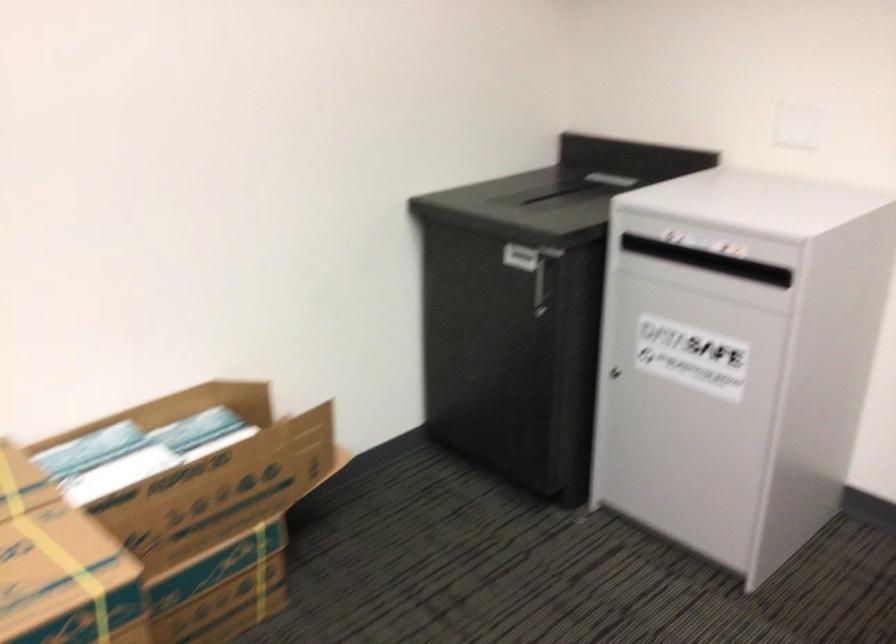
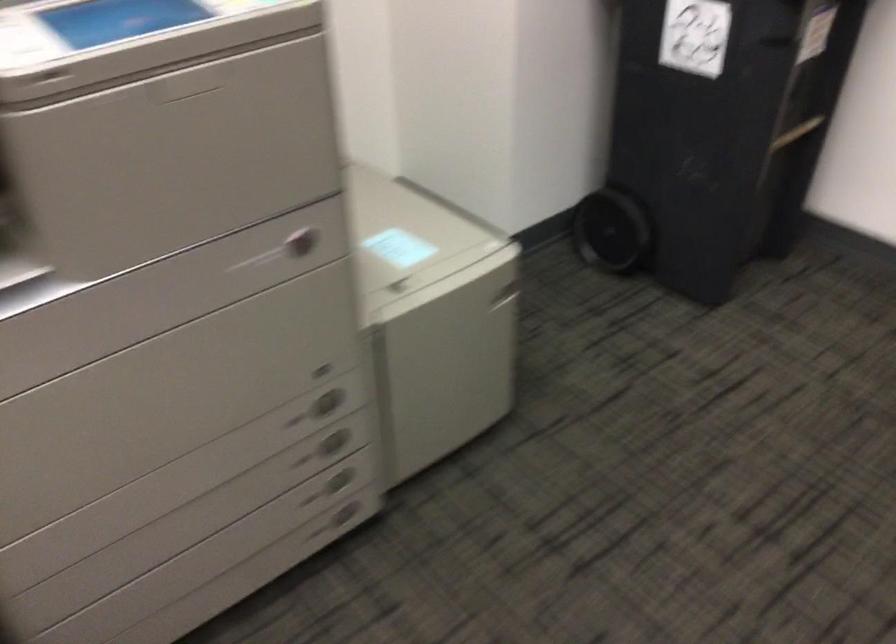
The images are taken continuously from a first-person perspective. In which direction is your viewpoint rotating?

The rotation direction of the camera is right-down.